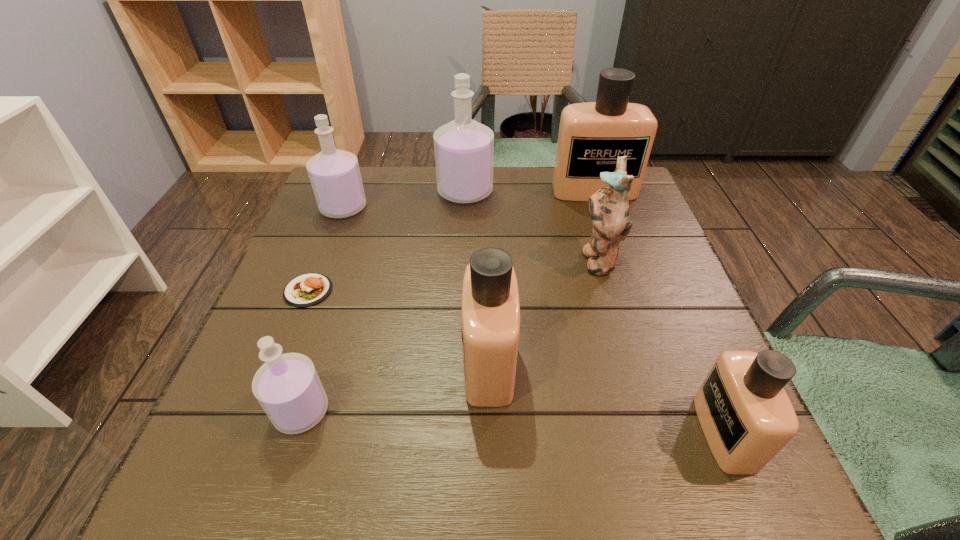
You are a GUI agent. You are given a task and a screenshot of the screen. Output one action in this format:
    pyautogui.click(x=<x>, y=<y>)
    Task: Click on the rightmost purple perfume
    
    Given the screenshot: What is the action you would take?
    pyautogui.click(x=464, y=149)

This screenshot has width=960, height=540. What are the coordinates of `the biggest beige perfume` in the screenshot? It's located at (592, 135).

Where is `pink figurine`? pink figurine is located at coordinates (609, 208).

Identify the location of the second biggest purple perfume. Image resolution: width=960 pixels, height=540 pixels. (334, 174).

Locate an element on the screen. the leftmost beige perfume is located at coordinates (490, 321).

Image resolution: width=960 pixels, height=540 pixels. Identify the location of the nearest purple perfume. (287, 386).

You are a GUI agent. You are given a task and a screenshot of the screen. Output one action in this format:
    pyautogui.click(x=<x>, y=<y>)
    Task: Click on the smallest beige perfume
    The height and width of the screenshot is (540, 960).
    Given the screenshot: What is the action you would take?
    pyautogui.click(x=747, y=417)

Where is `patty (food)`? patty (food) is located at coordinates (309, 289).

Where is `free space located 0.170m on the front of the rightmost purple perfume`? The height and width of the screenshot is (540, 960). free space located 0.170m on the front of the rightmost purple perfume is located at coordinates (463, 252).

You are a GUI agent. You are given a task and a screenshot of the screen. Output one action in this format:
    pyautogui.click(x=<x>, y=<y>)
    Task: Click on the free space located 0.400m on the front label of the biggest beige perfume
    This screenshot has width=960, height=540.
    Given the screenshot: What is the action you would take?
    pyautogui.click(x=638, y=322)